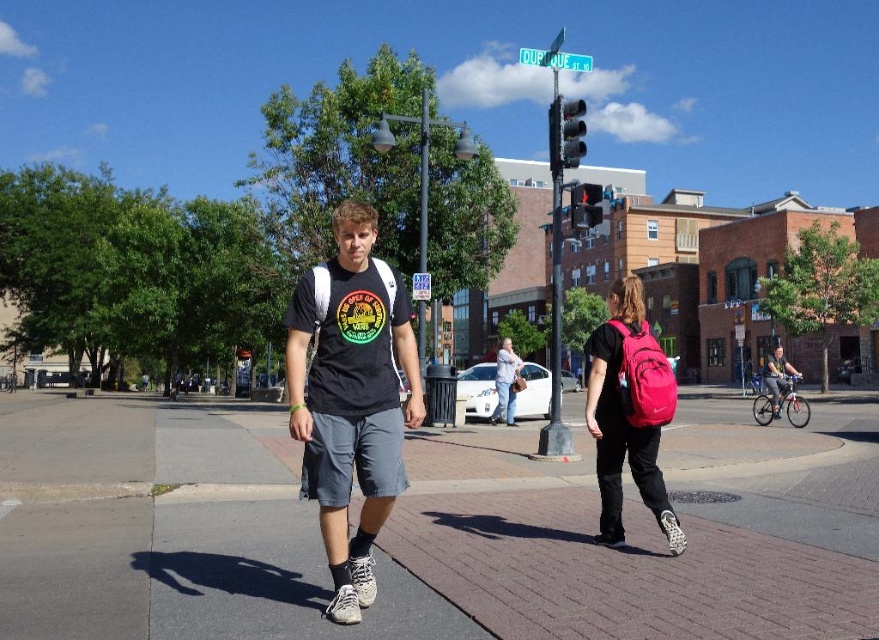
Who is taller, matte black t-shirt at center or matte black bicycle at right?

Standing taller between the two is matte black bicycle at right.

Is matte black t-shirt at center smaller than matte black bicycle at right?

Yes.

What do you see at coordinates (351, 397) in the screenshot? Image resolution: width=879 pixels, height=640 pixels. I see `matte black t-shirt at center` at bounding box center [351, 397].

You are a GUI agent. You are given a task and a screenshot of the screen. Output one action in this format:
    pyautogui.click(x=<x>, y=<y>)
    Task: Click on the matte black t-shirt at center
    The width and height of the screenshot is (879, 640).
    Given the screenshot: What is the action you would take?
    pyautogui.click(x=351, y=397)

Who is higher up, matte black t-shirt at center or matte black backpack at center?

matte black t-shirt at center is higher up.

The image size is (879, 640). Identify the location of matte black t-shirt at center. (351, 397).

Image resolution: width=879 pixels, height=640 pixels. Describe the element at coordinates (351, 397) in the screenshot. I see `matte black t-shirt at center` at that location.

I want to click on matte black t-shirt at center, so click(x=351, y=397).

Is pink fabric backpack at lower right bigger than matte black backpack at center?

Yes, pink fabric backpack at lower right is bigger than matte black backpack at center.

Describe the element at coordinates (629, 412) in the screenshot. The height and width of the screenshot is (640, 879). I see `pink fabric backpack at lower right` at that location.

Does point (629, 403) come behind point (498, 371)?

That is False.

Locate an element on the screen. This screenshot has width=879, height=640. pink fabric backpack at lower right is located at coordinates (629, 412).